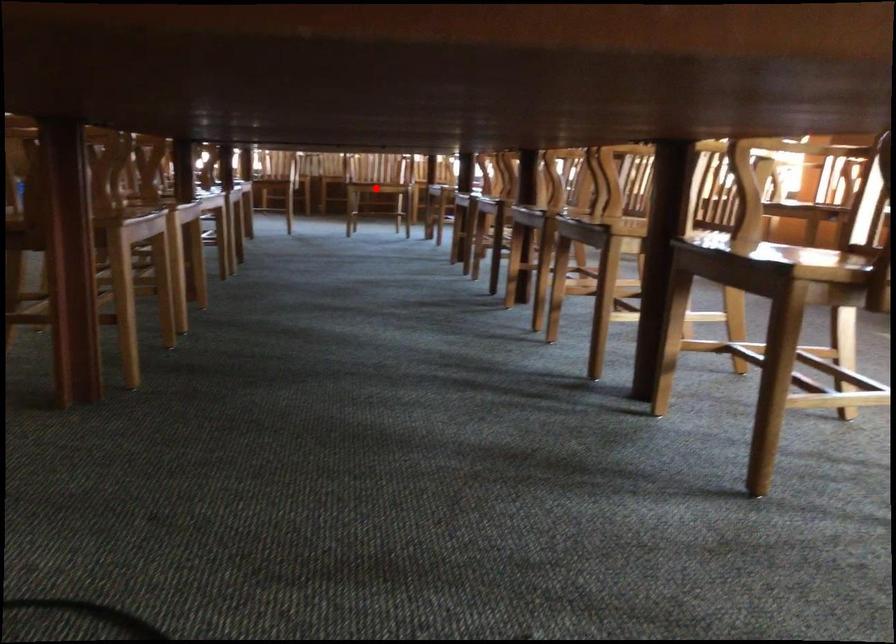
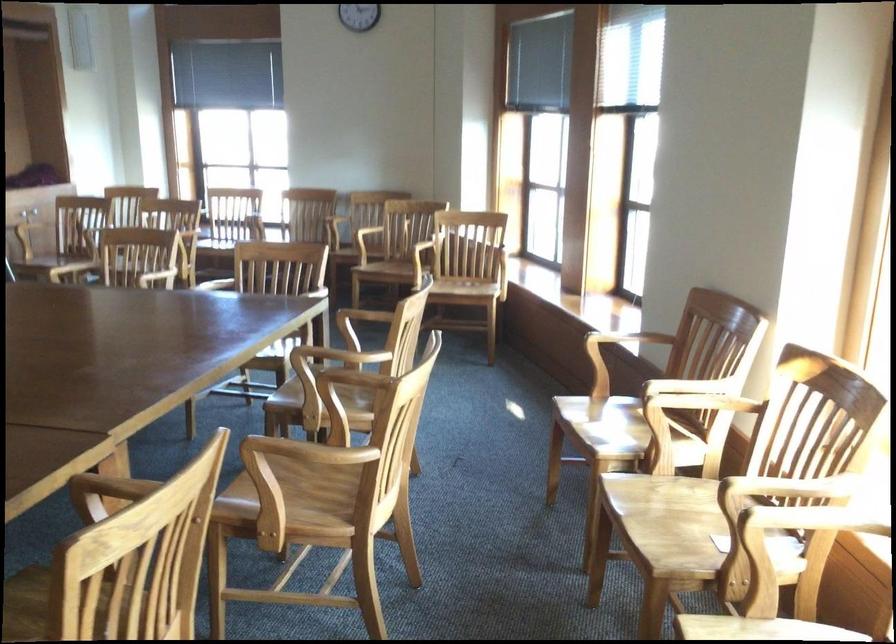
Question: I am providing you with two images of the same scene from different viewpoints. A red point is marked on the first image. At the location where the point appears in image 1, is it still visible in image 2?

Choices:
 (A) Yes
 (B) No

Answer: (B)